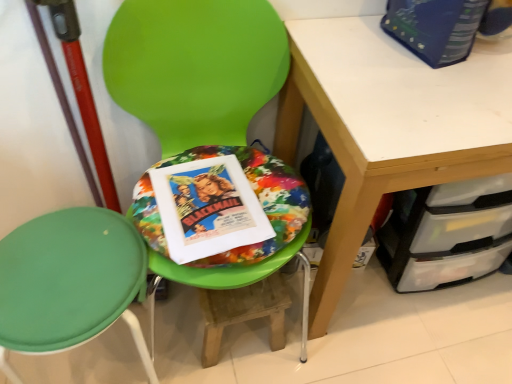
Image resolution: width=512 pixels, height=384 pixels. Describe the element at coordinates (435, 27) in the screenshot. I see `blue cardboard book at upper right, the second paperback book when ordered from bottom to top` at that location.

The image size is (512, 384). What are the coordinates of `green fabric chair at center, the first chair viewed from the left` in the screenshot? It's located at (70, 281).

The height and width of the screenshot is (384, 512). In order to click on white matte desk at upper right in this screenshot , I will do `click(389, 125)`.

From the image's perspective, relative to matte paper movie poster at center, the 2th paperback book from the right, is green fabric chair at center, acting as the 2th chair starting from the right, above or below?

green fabric chair at center, acting as the 2th chair starting from the right, is situated lower than matte paper movie poster at center, the 2th paperback book from the right, in the image.

Based on the photo, which is more to the left, green fabric chair at center, acting as the 2th chair starting from the right, or matte paper movie poster at center, which appears as the 1th paperback book when viewed from the left?

green fabric chair at center, acting as the 2th chair starting from the right.

Find the location of a particular element. The width and height of the screenshot is (512, 384). the 1st paperback book above the green fabric chair at center, acting as the 2th chair starting from the right (from the image's perspective) is located at coordinates (208, 208).

Is point (137, 254) closer or farther from the camera than point (198, 164)?

Point (137, 254).

Does wooden step stool at center appear on the right side of blue cardboard book at upper right, which ranks as the second paperback book in left-to-right order?

In fact, wooden step stool at center is to the left of blue cardboard book at upper right, which ranks as the second paperback book in left-to-right order.

Could you measure the distance between wooden step stool at center and blue cardboard book at upper right, the second paperback book when ordered from bottom to top?

wooden step stool at center is 28.56 inches away from blue cardboard book at upper right, the second paperback book when ordered from bottom to top.

Is point (225, 317) more distant than point (402, 16)?

Yes, point (225, 317) is behind point (402, 16).

Considering the sizes of wooden step stool at center and blue cardboard book at upper right, the second paperback book when ordered from bottom to top, in the image, is wooden step stool at center taller or shorter than blue cardboard book at upper right, the second paperback book when ordered from bottom to top,?

Considering their sizes, wooden step stool at center has more height than blue cardboard book at upper right, the second paperback book when ordered from bottom to top.

Who is taller, white matte desk at upper right or green fabric chair at center, acting as the 2th chair starting from the right?

Standing taller between the two is white matte desk at upper right.

Where is `desk that is on the right side of green fabric chair at center, acting as the 2th chair starting from the right`? desk that is on the right side of green fabric chair at center, acting as the 2th chair starting from the right is located at coordinates (389, 125).

From the image's perspective, which is below, white matte desk at upper right or green fabric chair at center, acting as the 2th chair starting from the right?

From the image's view, green fabric chair at center, acting as the 2th chair starting from the right, is below.

Which point is more distant from viewer, (383, 189) or (115, 222)?

The point (115, 222) is behind.

From the image's perspective, which one is positioned lower, wooden step stool at center or green plastic chair at center, which appears as the 2th chair when viewed from the left?

wooden step stool at center appears lower in the image.

From their relative heights in the image, would you say wooden step stool at center is taller or shorter than green plastic chair at center, which appears as the 2th chair when viewed from the left?

wooden step stool at center is shorter than green plastic chair at center, which appears as the 2th chair when viewed from the left.

Considering the sizes of objects wooden step stool at center and green plastic chair at center, which appears as the 2th chair when viewed from the left, in the image provided, who is thinner, wooden step stool at center or green plastic chair at center, which appears as the 2th chair when viewed from the left,?

wooden step stool at center is thinner.

Which object is further away from the camera taking this photo, wooden step stool at center or green plastic chair at center, which appears as the 2th chair when viewed from the left?

wooden step stool at center is behind.

Considering the relative sizes of green plastic chair at center, which is the first chair from right to left, and matte paper movie poster at center, the 2th paperback book from the right, in the image provided, is green plastic chair at center, which is the first chair from right to left, taller than matte paper movie poster at center, the 2th paperback book from the right,?

Yes.

From a real-world perspective, is green plastic chair at center, which is the first chair from right to left, physically below matte paper movie poster at center, the 2th paperback book from the right?

Yes, from a real-world perspective, green plastic chair at center, which is the first chair from right to left, is below matte paper movie poster at center, the 2th paperback book from the right.

Locate an element on the screen. paperback book lying below the green plastic chair at center, which is the first chair from right to left (from the image's perspective) is located at coordinates (208, 208).

Between point (176, 168) and point (436, 37), which one is positioned in front?

The point (436, 37) is closer to the camera.

Would you consider matte paper movie poster at center, the 2th paperback book viewed from the top, to be distant from blue cardboard book at upper right, the first paperback book positioned from the right?

matte paper movie poster at center, the 2th paperback book viewed from the top, is near blue cardboard book at upper right, the first paperback book positioned from the right, not far away.

From the image's perspective, is matte paper movie poster at center, the 2th paperback book from the right, over blue cardboard book at upper right, marked as the 1th paperback book in a top-to-bottom arrangement?

No, from the image's perspective, matte paper movie poster at center, the 2th paperback book from the right, is not above blue cardboard book at upper right, marked as the 1th paperback book in a top-to-bottom arrangement.

Looking at this image, considering the relative sizes of matte paper movie poster at center, which appears as the 1th paperback book when viewed from the left, and blue cardboard book at upper right, which ranks as the second paperback book in left-to-right order, in the image provided, is matte paper movie poster at center, which appears as the 1th paperback book when viewed from the left, shorter than blue cardboard book at upper right, which ranks as the second paperback book in left-to-right order,?

Indeed, matte paper movie poster at center, which appears as the 1th paperback book when viewed from the left, has a lesser height compared to blue cardboard book at upper right, which ranks as the second paperback book in left-to-right order.

Would you say blue cardboard book at upper right, which ranks as the second paperback book in left-to-right order, is outside matte paper movie poster at center, the 2th paperback book from the right?

Yes.

Is blue cardboard book at upper right, marked as the 1th paperback book in a top-to-bottom arrangement, bigger than matte paper movie poster at center, the 2th paperback book from the right?

Indeed, blue cardboard book at upper right, marked as the 1th paperback book in a top-to-bottom arrangement, has a larger size compared to matte paper movie poster at center, the 2th paperback book from the right.

From a real-world perspective, which object stands above the other?

From a 3D spatial view, blue cardboard book at upper right, marked as the 1th paperback book in a top-to-bottom arrangement, is above.

Locate an element on the screen. the 2nd paperback book behind the green fabric chair at center, the first chair viewed from the left, counting from the anchor's position is located at coordinates (208, 208).

Find the location of a particular element. This screenshot has height=384, width=512. step stool that appears below the blue cardboard book at upper right, which ranks as the second paperback book in left-to-right order (from a real-world perspective) is located at coordinates (243, 312).

Which object lies further to the anchor point green fabric chair at center, the first chair viewed from the left, matte paper movie poster at center, the 2th paperback book viewed from the top, or wooden step stool at center?

The object further to green fabric chair at center, the first chair viewed from the left, is wooden step stool at center.

Based on their spatial positions, is matte paper movie poster at center, the 2th paperback book viewed from the top, or green fabric chair at center, the first chair viewed from the left, further from blue cardboard book at upper right, which ranks as the second paperback book in left-to-right order?

Based on the image, green fabric chair at center, the first chair viewed from the left, appears to be further to blue cardboard book at upper right, which ranks as the second paperback book in left-to-right order.

Looking at the image, which one is located further to wooden step stool at center, matte paper movie poster at center, the 2th paperback book viewed from the top, or white matte desk at upper right?

white matte desk at upper right.

Which object lies further to the anchor point green fabric chair at center, the first chair viewed from the left, wooden step stool at center or white matte desk at upper right?

white matte desk at upper right is positioned further to the anchor green fabric chair at center, the first chair viewed from the left.

Based on the photo, when comparing their distances from green plastic chair at center, which appears as the 2th chair when viewed from the left, does blue cardboard book at upper right, marked as the 1th paperback book in a top-to-bottom arrangement, or matte paper movie poster at center, the 1th paperback book positioned from the bottom, seem closer?

matte paper movie poster at center, the 1th paperback book positioned from the bottom, is positioned closer to the anchor green plastic chair at center, which appears as the 2th chair when viewed from the left.

When comparing their distances from green plastic chair at center, which is the first chair from right to left, does blue cardboard book at upper right, marked as the 1th paperback book in a top-to-bottom arrangement, or white matte desk at upper right seem closer?

white matte desk at upper right is positioned closer to the anchor green plastic chair at center, which is the first chair from right to left.

From the image, which object appears to be nearer to white matte desk at upper right, matte paper movie poster at center, which appears as the 1th paperback book when viewed from the left, or blue cardboard book at upper right, marked as the 1th paperback book in a top-to-bottom arrangement?

blue cardboard book at upper right, marked as the 1th paperback book in a top-to-bottom arrangement, lies closer to white matte desk at upper right than the other object.

Based on their spatial positions, is green plastic chair at center, which is the first chair from right to left, or wooden step stool at center closer to matte paper movie poster at center, the 2th paperback book from the right?

Based on the image, green plastic chair at center, which is the first chair from right to left, appears to be nearer to matte paper movie poster at center, the 2th paperback book from the right.

You are a GUI agent. You are given a task and a screenshot of the screen. Output one action in this format:
    pyautogui.click(x=<x>, y=<y>)
    Task: Click on the chair between green fabric chair at center, acting as the 2th chair starting from the right, and white matte desk at upper right
    This screenshot has height=384, width=512.
    Given the screenshot: What is the action you would take?
    pyautogui.click(x=193, y=65)

Identify the location of step stool between matte paper movie poster at center, the 1th paperback book positioned from the bottom, and white matte desk at upper right from left to right. Image resolution: width=512 pixels, height=384 pixels. (243, 312).

Locate an element on the screen. The width and height of the screenshot is (512, 384). step stool between green fabric chair at center, acting as the 2th chair starting from the right, and white matte desk at upper right from left to right is located at coordinates (243, 312).

Identify the location of chair between blue cardboard book at upper right, the first paperback book positioned from the right, and wooden step stool at center vertically. (193, 65).